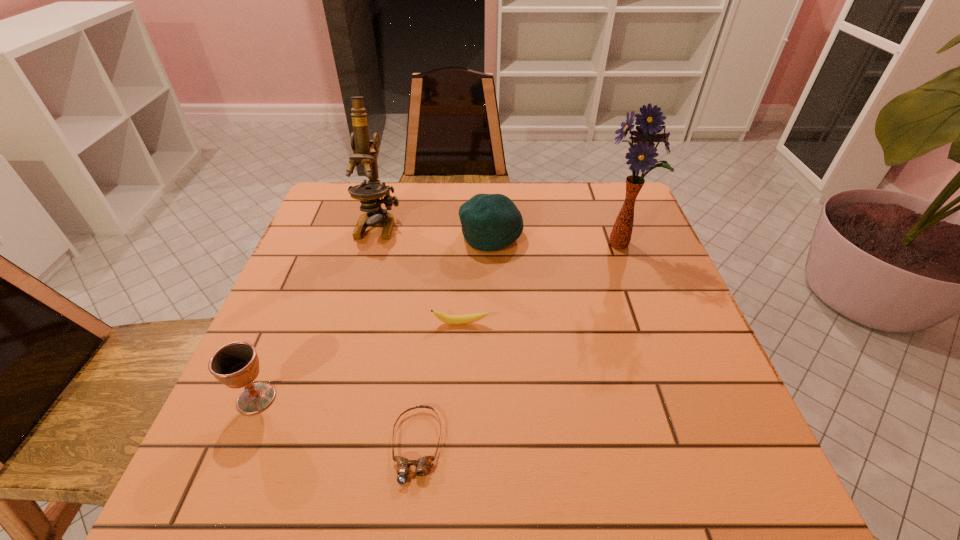
You are a GUI agent. You are given a task and a screenshot of the screen. Output one action in this format:
    pyautogui.click(x=<x>, y=<y>)
    Task: Click on the flower arrangement
    This screenshot has width=960, height=540.
    Given the screenshot: What is the action you would take?
    pyautogui.click(x=641, y=155)

The width and height of the screenshot is (960, 540). What are the coordinates of `the fifth object from right to left` in the screenshot? It's located at (369, 194).

The width and height of the screenshot is (960, 540). I want to click on beanie, so click(490, 222).

Find the location of `chalice`. chalice is located at coordinates (236, 365).

Locate an element on the screen. Image resolution: width=960 pixels, height=540 pixels. banana is located at coordinates (468, 318).

Find the location of a particular element. The width and height of the screenshot is (960, 540). the second shortest object is located at coordinates (468, 318).

Locate an element on the screen. The image size is (960, 540). goggles is located at coordinates (422, 464).

Where is `vacant space located 0.300m on the front of the flower arrangement`? The image size is (960, 540). vacant space located 0.300m on the front of the flower arrangement is located at coordinates (665, 364).

The height and width of the screenshot is (540, 960). Find the location of `vacant space situated on the right of the fifth object from right to left`. vacant space situated on the right of the fifth object from right to left is located at coordinates (542, 224).

What are the coordinates of `vacant region located on the front of the beanie` in the screenshot? It's located at click(x=493, y=328).